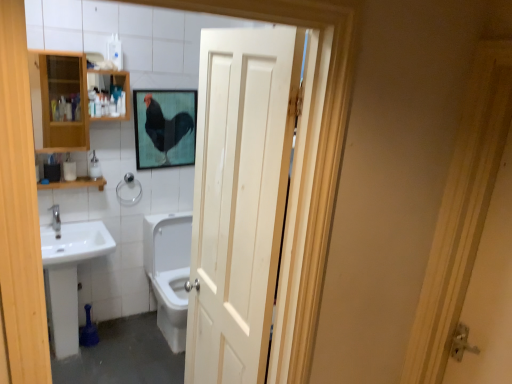
Question: Could matte black rooster at upper center be considered to be inside white glossy soap dispenser at left?

Choices:
 (A) yes
 (B) no

Answer: (B)

Question: Does white glossy soap dispenser at left have a greater height compared to matte black rooster at upper center?

Choices:
 (A) no
 (B) yes

Answer: (A)

Question: Is white glossy soap dispenser at left further to camera compared to matte black rooster at upper center?

Choices:
 (A) yes
 (B) no

Answer: (B)

Question: From the image's perspective, would you say white glossy soap dispenser at left is shown under matte black rooster at upper center?

Choices:
 (A) yes
 (B) no

Answer: (A)

Question: From the image's perspective, is white glossy soap dispenser at left on top of matte black rooster at upper center?

Choices:
 (A) yes
 (B) no

Answer: (B)

Question: Is white glossy soap dispenser at left at the left side of matte black rooster at upper center?

Choices:
 (A) no
 (B) yes

Answer: (B)

Question: From a real-world perspective, is wooden shelf at left under matte black rooster at upper center?

Choices:
 (A) yes
 (B) no

Answer: (A)

Question: From a real-world perspective, is wooden shelf at left on top of matte black rooster at upper center?

Choices:
 (A) yes
 (B) no

Answer: (B)

Question: Considering the relative sizes of wooden shelf at left and matte black rooster at upper center in the image provided, is wooden shelf at left bigger than matte black rooster at upper center?

Choices:
 (A) no
 (B) yes

Answer: (A)

Question: Considering the relative sizes of wooden shelf at left and matte black rooster at upper center in the image provided, is wooden shelf at left taller than matte black rooster at upper center?

Choices:
 (A) yes
 (B) no

Answer: (B)

Question: Can you confirm if wooden shelf at left is thinner than matte black rooster at upper center?

Choices:
 (A) no
 (B) yes

Answer: (A)

Question: Considering the relative positions of wooden shelf at left and matte black rooster at upper center in the image provided, is wooden shelf at left in front of matte black rooster at upper center?

Choices:
 (A) yes
 (B) no

Answer: (A)

Question: Considering the relative sizes of white matte toilet paper at left and silver metallic towel bar at center left in the image provided, is white matte toilet paper at left wider than silver metallic towel bar at center left?

Choices:
 (A) no
 (B) yes

Answer: (B)